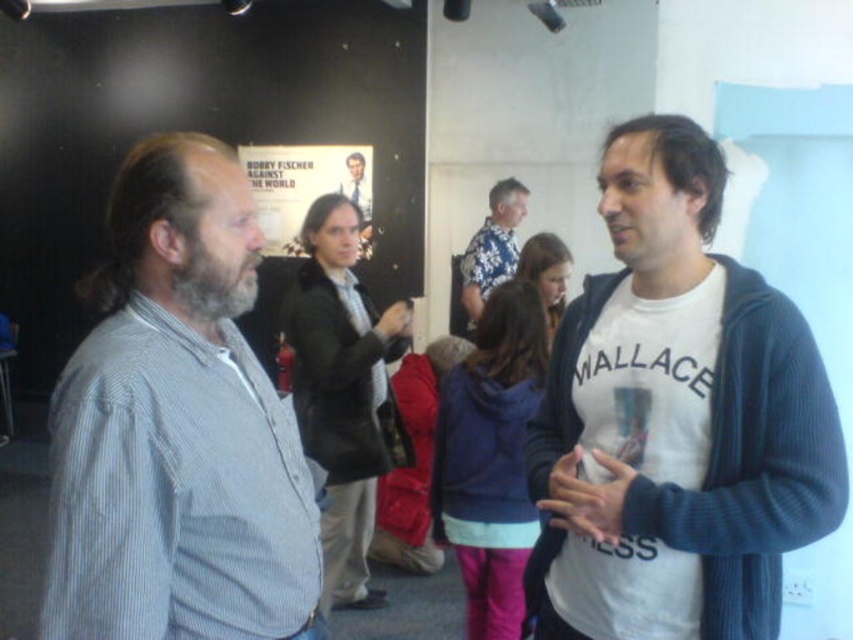
Which of these two, white cotton t-shirt at center or floral fabric shirt at center, stands taller?

white cotton t-shirt at center is taller.

Can you confirm if white cotton t-shirt at center is smaller than floral fabric shirt at center?

Correct, white cotton t-shirt at center occupies less space than floral fabric shirt at center.

Is point (785, 492) positioned before point (515, 193)?

Yes, point (785, 492) is in front of point (515, 193).

The image size is (853, 640). Find the location of `white cotton t-shirt at center`. white cotton t-shirt at center is located at coordinates (682, 419).

Can you confirm if striped cotton shirt at left is thinner than smooth black suit at center?

No.

Measure the distance from striped cotton shirt at left to smooth black suit at center.

They are 4.36 meters apart.

Does point (143, 250) come closer to viewer compared to point (364, 188)?

Yes, point (143, 250) is in front of point (364, 188).

Locate an element on the screen. striped cotton shirt at left is located at coordinates (177, 426).

Is point (733, 550) positioned behind point (360, 205)?

No, (733, 550) is closer to viewer.

Can you confirm if white cotton t-shirt at center is positioned above smooth black suit at center?

Actually, white cotton t-shirt at center is below smooth black suit at center.

You are a GUI agent. You are given a task and a screenshot of the screen. Output one action in this format:
    pyautogui.click(x=<x>, y=<y>)
    Task: Click on the white cotton t-shirt at center
    This screenshot has height=640, width=853.
    Given the screenshot: What is the action you would take?
    pyautogui.click(x=682, y=419)